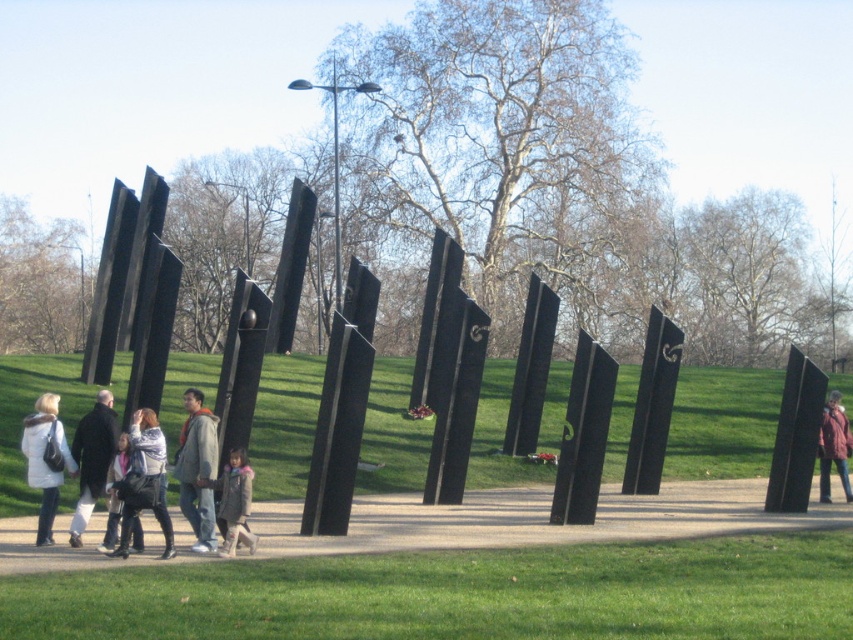
Looking at this image, you are a photographer standing in the grassy area. You want to take a photo of the two people wearing the gray hoodie at center and dark gray coat at center. Can you fit both of them in the frame if your camera has a field of view that can capture 36 inches horizontally?

The gray hoodie at center and dark gray coat at center are 32.95 inches apart, which is less than the camera field of view of 36 inches. Therefore, both can be captured in the frame.

You are a photographer standing in the grassy area. You see the dark gray coat at center and the matte black jacket at center. Which clothing item is closer to the camera?

The dark gray coat at center is located above the matte black jacket at center, so the dark gray coat at center is closer to the camera.

You are standing at the camera position and want to find the gray hoodie at center. According to the coordinates, where should you look?

The gray hoodie at center is located at coordinates point (x=196, y=468), so you should look towards the lower right direction from the center of the image.